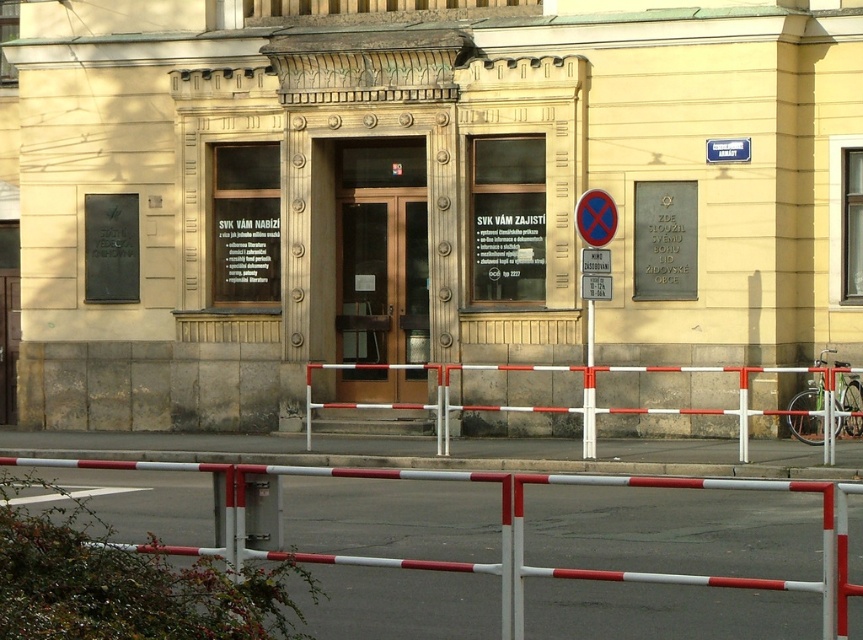
You are a visitor approaching the building entrance. You see the bronze glass door at center and the white metal barricade at center. Which object is closer to you as you approach the entrance?

The bronze glass door at center is closer to you because the white metal barricade at center is behind it.